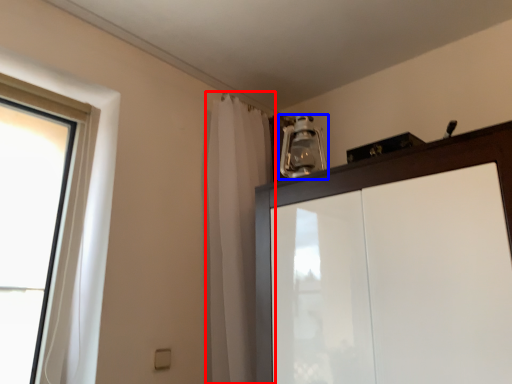
Question: Which point is closer to the camera, shower curtain (highlighted by a red box) or light fixture (highlighted by a blue box)?

Choices:
 (A) shower curtain
 (B) light fixture

Answer: (A)